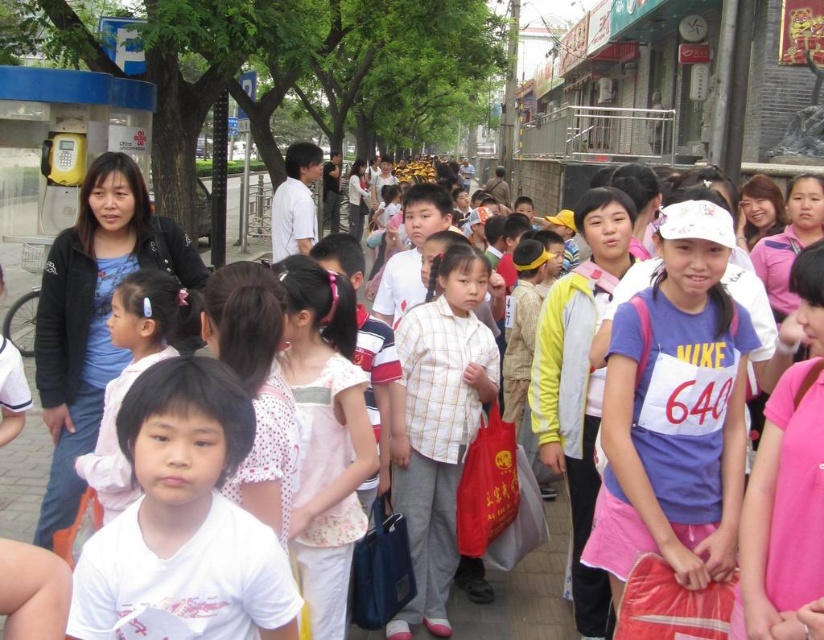
You are a photographer trying to capture a candid shot of the white dotted shirt at center and the pink fabric hairband at center. Since you want to ensure both are in focus, you need to know which object is narrower. Which one is thinner?

The white dotted shirt at center is thinner than the pink fabric hairband at center, so you should focus on the white dotted shirt at center first as it is narrower.

You are a photographer trying to capture a candid shot of the white matte shirt at center and the pink fabric hairband at center. Since you want to ensure both subjects are in focus, which one should you adjust your camera focus to prioritize based on their positions?

The white matte shirt at center is shorter than the pink fabric hairband at center, so you should prioritize focusing on the pink fabric hairband at center because it is farther away and requires a deeper focus to ensure clarity.

You are a photographer trying to capture a candid shot of the pink fabric hairband at center without including the white matte shirt at center in the frame. Based on their positions, is this possible?

The white matte shirt at center is positioned on the right side of the pink fabric hairband at center. Since the white matte shirt is to the right of the pink fabric hairband, you can adjust your angle or zoom to focus solely on the pink fabric hairband at center while excluding the white matte shirt at center by moving slightly to the left or right to frame it appropriately.